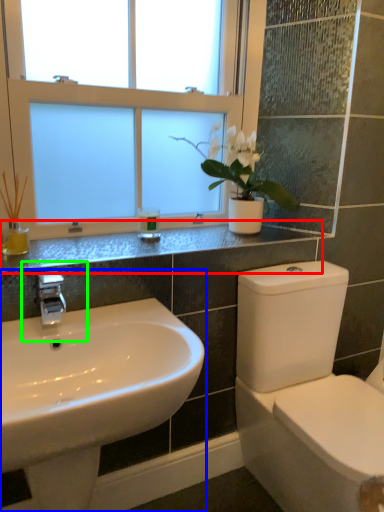
Question: Which object is the closest to the counter top (highlighted by a red box)? Choose among these: sink (highlighted by a blue box) or plumbing fixture (highlighted by a green box).

Choices:
 (A) sink
 (B) plumbing fixture

Answer: (B)